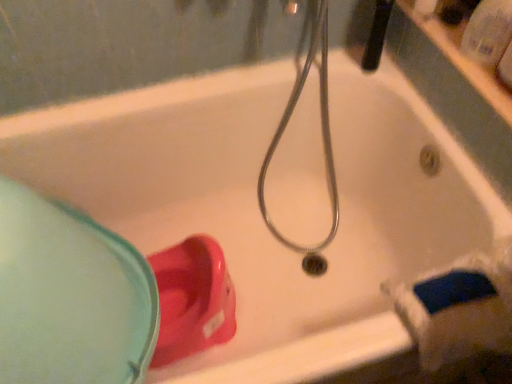
Question: From a real-world perspective, is matte plastic cup at lower left positioned above or below transparent plastic bottle at upper right?

Choices:
 (A) above
 (B) below

Answer: (B)

Question: Is matte plastic cup at lower left to the left or to the right of transparent plastic bottle at upper right in the image?

Choices:
 (A) left
 (B) right

Answer: (A)

Question: Estimate the real-world distances between objects in this image. Which object is farther from the black rubber showerhead at upper center?

Choices:
 (A) transparent plastic bottle at upper right
 (B) matte plastic cup at lower left

Answer: (B)

Question: Estimate the real-world distances between objects in this image. Which object is closer to the matte plastic cup at lower left?

Choices:
 (A) transparent plastic bottle at upper right
 (B) black rubber showerhead at upper center

Answer: (B)